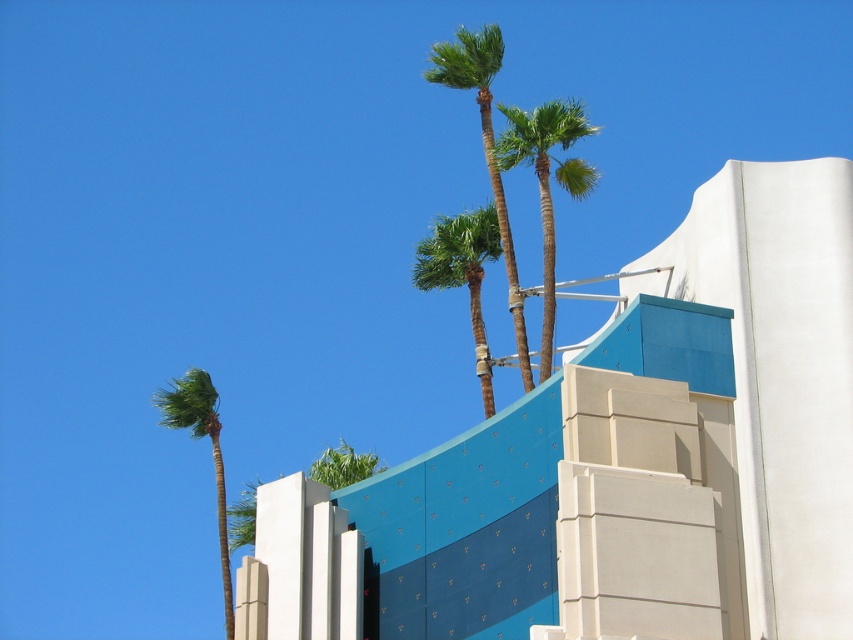
Who is shorter, blue textured wall at upper center or green leafy palm tree at upper left?

Standing shorter between the two is blue textured wall at upper center.

Who is more distant from viewer, (675,362) or (163,392)?

→ The point (163,392) is more distant.

Where is `blue textured wall at upper center`? This screenshot has width=853, height=640. blue textured wall at upper center is located at coordinates (621, 461).

Consider the image. Can you confirm if green leafy palm trees at upper center is positioned to the right of green leafy palm tree at upper center?

Correct, you'll find green leafy palm trees at upper center to the right of green leafy palm tree at upper center.

Is point (502, 243) closer to camera compared to point (474, 266)?

That is True.

Is point (491, 168) more distant than point (474, 326)?

No, it is not.

At what (x,y) coordinates should I click in order to perform the action: click on green leafy palm trees at upper center. Please return your answer as a coordinate pair (x, y). The height and width of the screenshot is (640, 853). Looking at the image, I should click on 485,144.

Who is more forward, [488,241] or [219,508]?

Point [488,241] is in front.

Does point (490, 204) come in front of point (209, 384)?

No, it is not.

Is point (415, 268) behind point (225, 628)?

Yes.

In order to click on green leafy palm tree at upper center in this screenshot , I will do `click(462, 273)`.